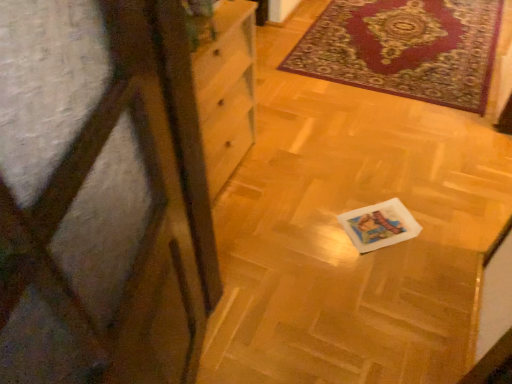
Question: From a real-world perspective, is velvet-like red rug at upper right physically located above or below transparent plastic screen door at left?

Choices:
 (A) above
 (B) below

Answer: (B)

Question: From the image's perspective, is velvet-like red rug at upper right positioned above or below transparent plastic screen door at left?

Choices:
 (A) above
 (B) below

Answer: (A)

Question: Which is correct: velvet-like red rug at upper right is inside transparent plastic screen door at left, or outside of it?

Choices:
 (A) outside
 (B) inside

Answer: (A)

Question: Which is correct: transparent plastic screen door at left is inside velvet-like red rug at upper right, or outside of it?

Choices:
 (A) inside
 (B) outside

Answer: (B)

Question: Is point (198, 248) closer or farther from the camera than point (408, 46)?

Choices:
 (A) closer
 (B) farther

Answer: (A)

Question: Looking at their shapes, would you say transparent plastic screen door at left is wider or thinner than velvet-like red rug at upper right?

Choices:
 (A) wide
 (B) thin

Answer: (B)

Question: Based on their positions, is transparent plastic screen door at left located to the left or right of velvet-like red rug at upper right?

Choices:
 (A) right
 (B) left

Answer: (B)